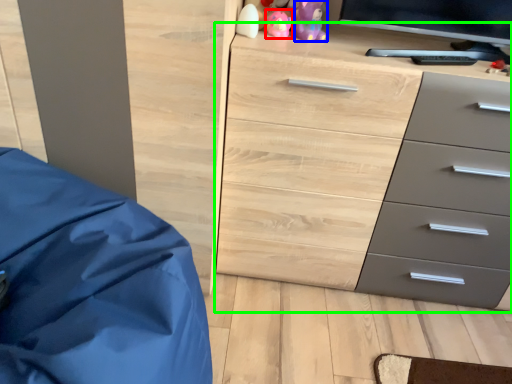
Question: Which is nearer to the toy (highlighted by a red box)? toy (highlighted by a blue box) or chest of drawers (highlighted by a green box).

Choices:
 (A) toy
 (B) chest of drawers

Answer: (A)